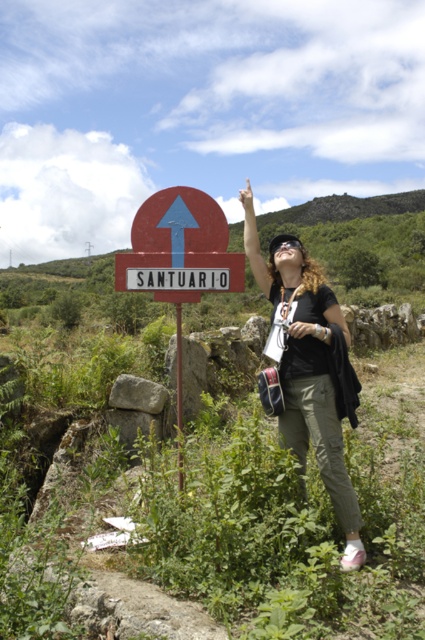
Is red metal sign at upper center positioned at the back of black matte goggles at upper center?

That is True.

Describe the element at coordinates (180, 272) in the screenshot. The width and height of the screenshot is (425, 640). I see `red metal sign at upper center` at that location.

Is point (129, 275) closer to camera compared to point (294, 241)?

No, it is behind (294, 241).

The width and height of the screenshot is (425, 640). I want to click on red metal sign at upper center, so click(x=180, y=272).

Who is more forward, (346, 557) or (175, 316)?

Point (346, 557) is more forward.

Which of these two, matte black shirt at upper center or red painted metal signpost at left, stands shorter?

Standing shorter between the two is red painted metal signpost at left.

Based on the photo, who is more forward, (297, 339) or (178, 422)?

Point (297, 339)

Where is `matte black shirt at upper center`? matte black shirt at upper center is located at coordinates (308, 369).

Does point (311, 429) come in front of point (212, 257)?

Yes.

Who is more forward, (x=311, y=340) or (x=122, y=266)?

Point (x=311, y=340) is in front.

Where is `matte black shirt at upper center`? matte black shirt at upper center is located at coordinates (308, 369).